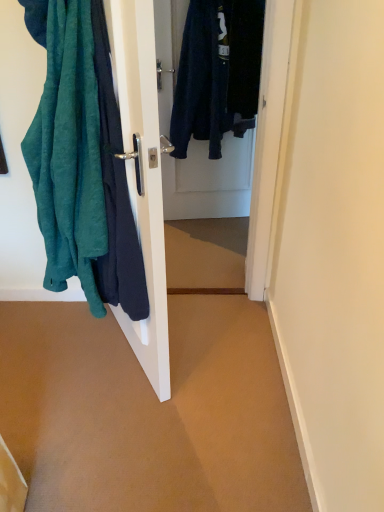
The height and width of the screenshot is (512, 384). Identify the location of dark blue fabric door at center. (209, 181).

Describe the element at coordinates (209, 181) in the screenshot. The width and height of the screenshot is (384, 512). I see `dark blue fabric door at center` at that location.

The width and height of the screenshot is (384, 512). What are the coordinates of `teal fabric at left` in the screenshot? It's located at (142, 176).

What do you see at coordinates (142, 176) in the screenshot?
I see `teal fabric at left` at bounding box center [142, 176].

Find the location of `dark blue fabric door at center`. dark blue fabric door at center is located at coordinates (209, 181).

Based on their positions, is teal fabric at left located to the left or right of dark blue fabric door at center?

Based on their positions, teal fabric at left is located to the left of dark blue fabric door at center.

Is teal fabric at left positioned before dark blue fabric door at center?

Yes, teal fabric at left is closer to the viewer.

Which is closer to the camera, (133, 100) or (233, 151)?

Point (133, 100) appears to be closer to the viewer than point (233, 151).

From the image's perspective, would you say teal fabric at left is shown under dark blue fabric door at center?

Yes, from the image's perspective, teal fabric at left is below dark blue fabric door at center.

From a real-world perspective, is teal fabric at left on top of dark blue fabric door at center?

Yes.

In the scene shown: Is teal fabric at left wider than dark blue fabric door at center?

Correct, the width of teal fabric at left exceeds that of dark blue fabric door at center.

Considering the sizes of teal fabric at left and dark blue fabric door at center in the image, is teal fabric at left taller or shorter than dark blue fabric door at center?

In the image, teal fabric at left appears to be taller than dark blue fabric door at center.

Is teal fabric at left bigger than dark blue fabric door at center?

Correct, teal fabric at left is larger in size than dark blue fabric door at center.

Is dark blue fabric door at center inside teal fabric at left?

No, dark blue fabric door at center is not inside teal fabric at left.

Can you see teal fabric at left touching dark blue fabric door at center?

teal fabric at left is not next to dark blue fabric door at center, and they're not touching.

Is dark blue fabric door at center at the back of teal fabric at left?

teal fabric at left is not turned away from dark blue fabric door at center.

Locate an element on the screen. door above the teal fabric at left (from the image's perspective) is located at coordinates tap(209, 181).

In the image, is dark blue fabric door at center on the left side or the right side of teal fabric at left?

dark blue fabric door at center is to the right of teal fabric at left.

Is dark blue fabric door at center positioned behind teal fabric at left?

Yes, dark blue fabric door at center is behind teal fabric at left.

Which is farther, (164, 96) or (142, 216)?

The point (164, 96) is farther.

From the image's perspective, between dark blue fabric door at center and teal fabric at left, who is located below?

From the image's view, teal fabric at left is below.

From a real-world perspective, is dark blue fabric door at center over teal fabric at left?

No, from a real-world perspective, dark blue fabric door at center is not above teal fabric at left.

Can you confirm if dark blue fabric door at center is wider than teal fabric at left?

Incorrect, the width of dark blue fabric door at center does not surpass that of teal fabric at left.

In terms of height, does dark blue fabric door at center look taller or shorter compared to teal fabric at left?

Clearly, dark blue fabric door at center is shorter compared to teal fabric at left.

Considering the sizes of dark blue fabric door at center and teal fabric at left in the image, is dark blue fabric door at center bigger or smaller than teal fabric at left?

In the image, dark blue fabric door at center appears to be smaller than teal fabric at left.

Would you say dark blue fabric door at center is inside or outside teal fabric at left?

dark blue fabric door at center is not enclosed by teal fabric at left.

Is dark blue fabric door at center with teal fabric at left?

No, dark blue fabric door at center is not making contact with teal fabric at left.

Is dark blue fabric door at center facing towards teal fabric at left?

Yes, dark blue fabric door at center is aimed at teal fabric at left.

From the picture: What's the angular difference between dark blue fabric door at center and teal fabric at left's facing directions?

75 degrees separate the facing orientations of dark blue fabric door at center and teal fabric at left.

You are a GUI agent. You are given a task and a screenshot of the screen. Output one action in this format:
    pyautogui.click(x=<x>, y=<y>)
    Task: Click on the door located behind the teal fabric at left
    
    Given the screenshot: What is the action you would take?
    pyautogui.click(x=209, y=181)

Where is `door behind the teal fabric at left`? The image size is (384, 512). door behind the teal fabric at left is located at coordinates (209, 181).

Find the location of a particular element. Image resolution: width=384 pixels, height=512 pixels. closet that is in front of the dark blue fabric door at center is located at coordinates (142, 176).